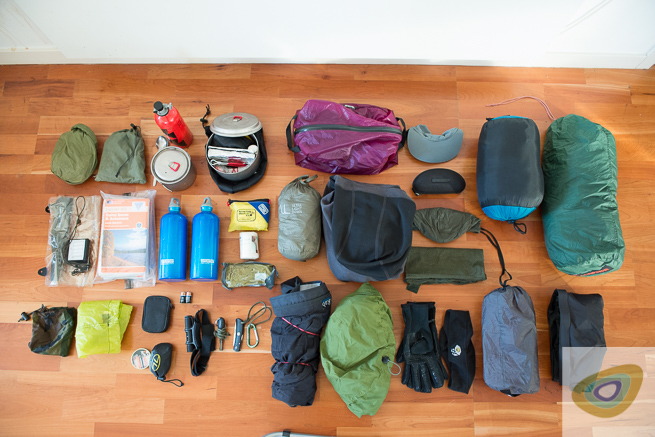
Where is `floor`? floor is located at coordinates (432, 97).